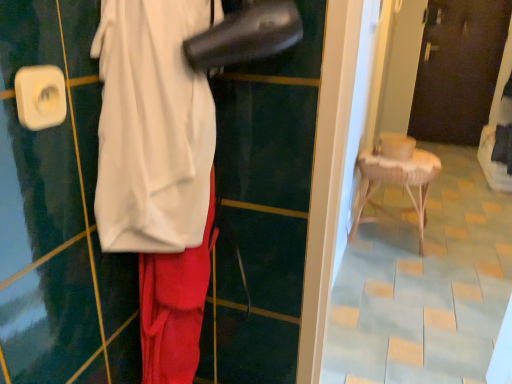
Question: From the image's perspective, is dark brown wooden door at upper center positioned above or below white fabric at center?

Choices:
 (A) below
 (B) above

Answer: (B)

Question: In terms of height, does dark brown wooden door at upper center look taller or shorter compared to white fabric at center?

Choices:
 (A) short
 (B) tall

Answer: (B)

Question: Estimate the real-world distances between objects in this image. Which object is farther from the white fabric at center?

Choices:
 (A) woven wood stool at right
 (B) dark brown wooden door at upper center

Answer: (B)

Question: Which is nearer to the white fabric at center?

Choices:
 (A) woven wood stool at right
 (B) dark brown wooden door at upper center

Answer: (A)